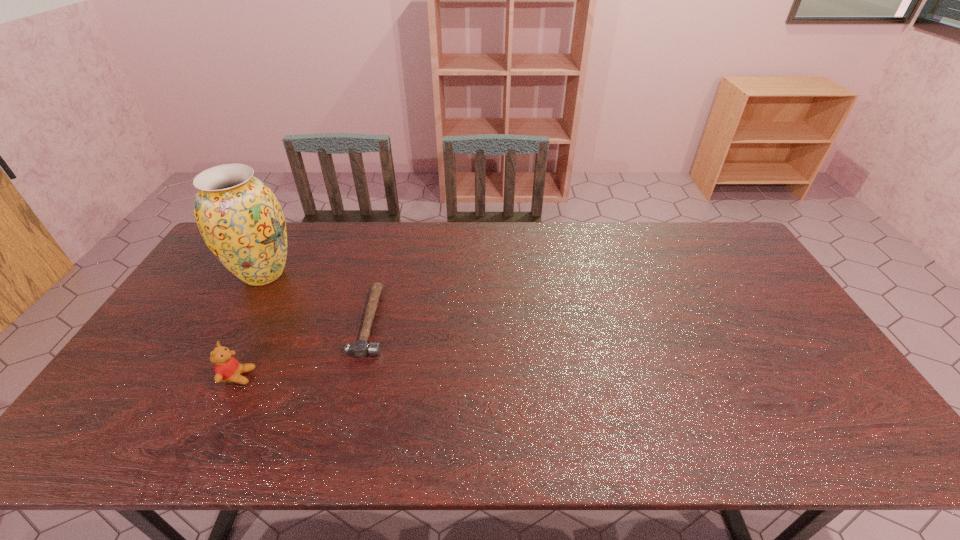
Where is `object positioned at the far left corner`? This screenshot has height=540, width=960. object positioned at the far left corner is located at coordinates (241, 221).

This screenshot has width=960, height=540. What are the coordinates of `vacant region at the far edge` in the screenshot? It's located at (619, 252).

Image resolution: width=960 pixels, height=540 pixels. In order to click on vacant space at the near edge of the desktop in this screenshot , I will do `click(273, 427)`.

Image resolution: width=960 pixels, height=540 pixels. Identify the location of free region at the left edge of the desktop. (122, 408).

Where is `blank area at the right edge`? blank area at the right edge is located at coordinates (863, 416).

In the image, there is a desktop. At what (x,y) coordinates should I click in order to perform the action: click on free space at the far right corner. Please return your answer as a coordinate pair (x, y). This screenshot has width=960, height=540. Looking at the image, I should click on (700, 248).

You are a GUI agent. You are given a task and a screenshot of the screen. Output one action in this format:
    pyautogui.click(x=<x>, y=<y>)
    Task: Click on the unoccupied area between the nearest object and the vase
    
    Given the screenshot: What is the action you would take?
    pyautogui.click(x=251, y=325)

The height and width of the screenshot is (540, 960). Identify the location of vacant region between the second shortest object and the rightmost object. (304, 349).

Identify the location of empty space that is in between the teddy bear and the shortest object. The width and height of the screenshot is (960, 540). (304, 349).

Locate an element on the screen. unoccupied position between the second shortest object and the shortest object is located at coordinates (304, 349).